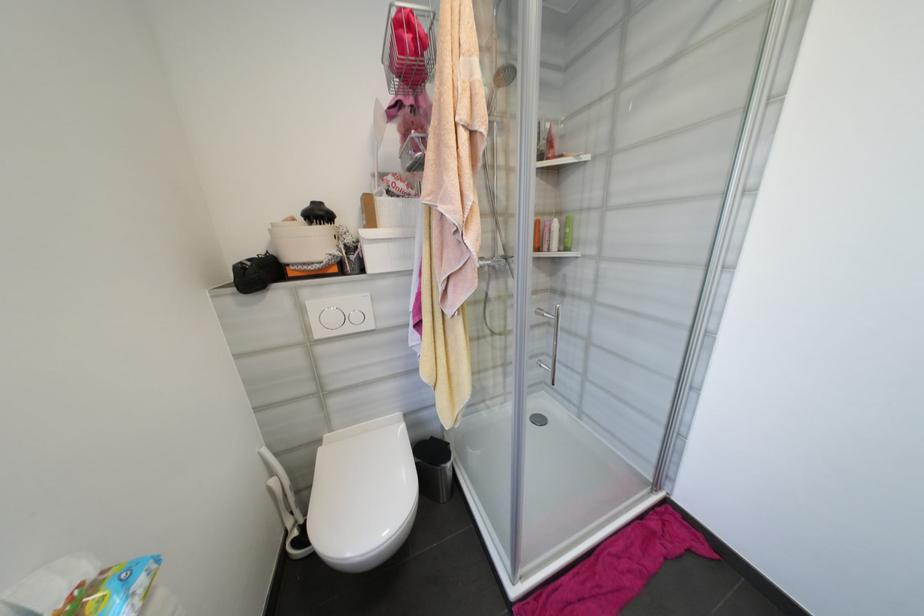
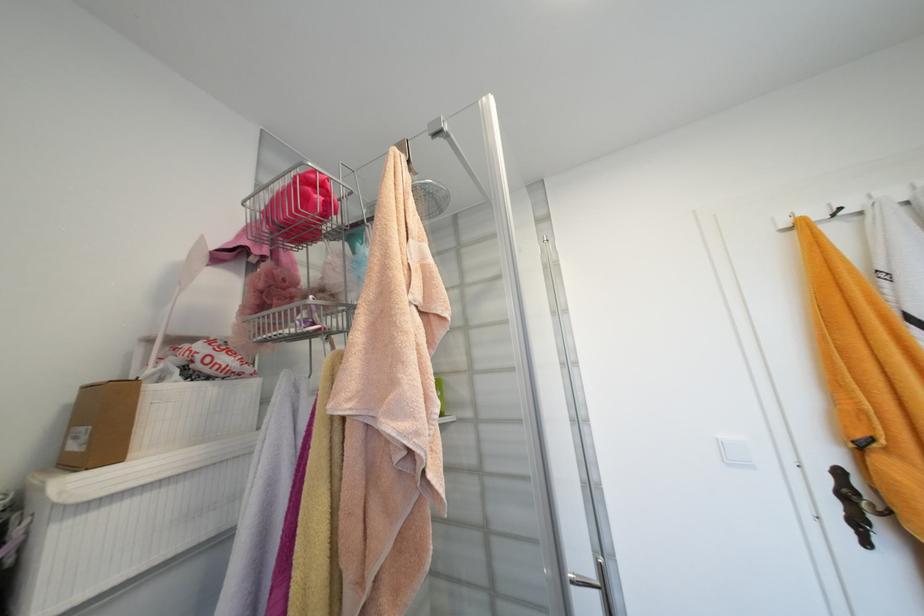
Find the pixel in the second image that matches (407,200) in the first image.

(224, 383)